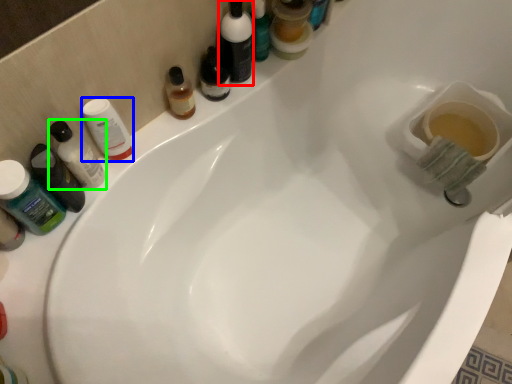
Question: Which object is positioned closest to toiletry (highlighted by a red box)? Select from mouthwash (highlighted by a blue box) and mouthwash (highlighted by a green box).

Choices:
 (A) mouthwash
 (B) mouthwash

Answer: (A)